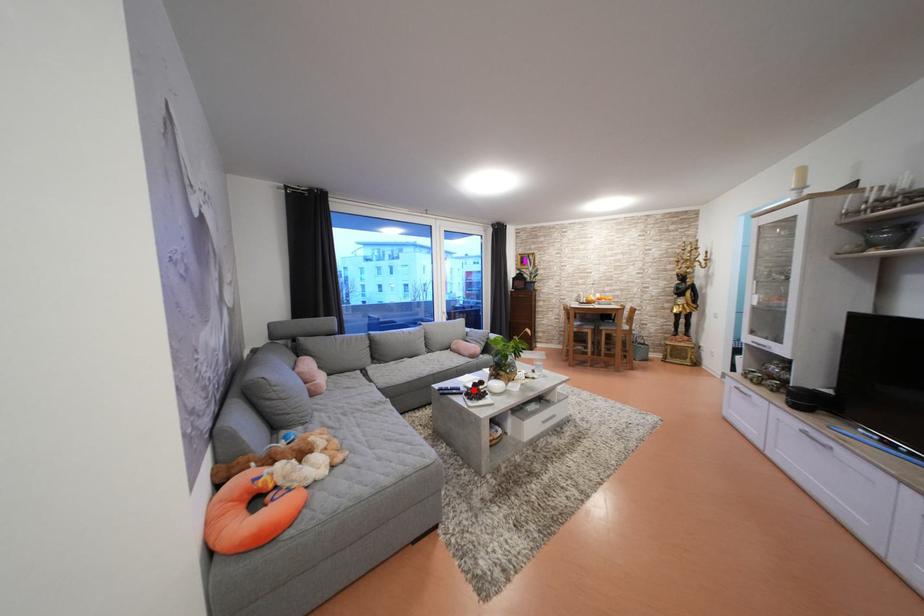
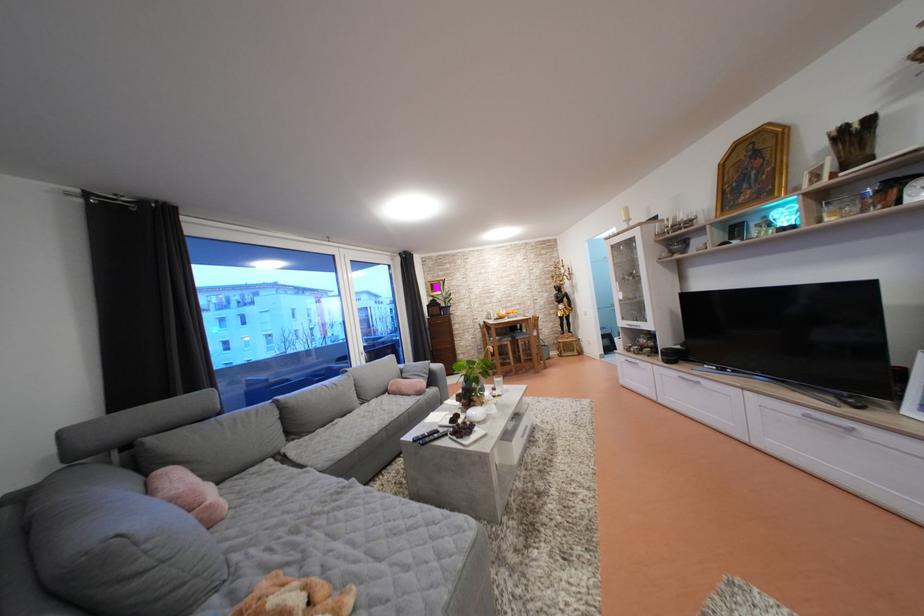
In the second image, find the point that corresponds to the highlighted location in the first image.

(448, 429)